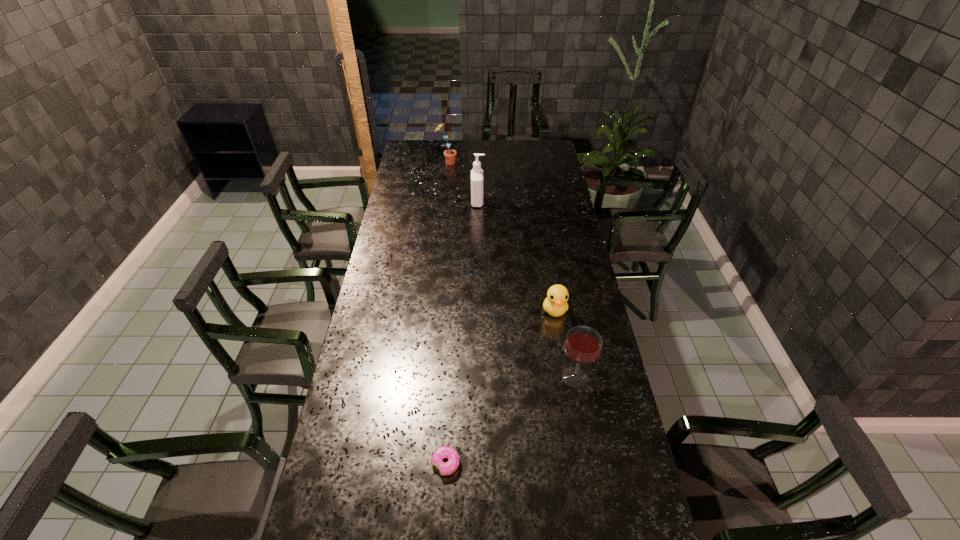
Where is `cleansing agent`? This screenshot has width=960, height=540. cleansing agent is located at coordinates (476, 173).

What are the coordinates of `the third object from left to right` in the screenshot? It's located at pyautogui.click(x=476, y=173).

You are a GUI agent. You are given a task and a screenshot of the screen. Output one action in this format:
    pyautogui.click(x=<x>, y=<y>)
    Task: Click on the farthest object
    This screenshot has width=960, height=540.
    Given the screenshot: What is the action you would take?
    pyautogui.click(x=450, y=155)

Identify the location of the fourth farthest object. Image resolution: width=960 pixels, height=540 pixels. (583, 344).

Locate an element on the screen. the second shortest object is located at coordinates (555, 304).

Locate an element on the screen. duck is located at coordinates (555, 304).

You are a GUI agent. You are given a task and a screenshot of the screen. Output one action in this format:
    pyautogui.click(x=<x>, y=<y>)
    Task: Click on the shortest object
    
    Given the screenshot: What is the action you would take?
    (446, 468)

Find the location of a particular element. This screenshot has width=960, height=540. the nearest object is located at coordinates (446, 468).

You are a GUI agent. You are given a task and a screenshot of the screen. Output one action in this format:
    pyautogui.click(x=<x>, y=<y>)
    Task: Click on the vacant region located 0.190m on the front label of the cleansing agent
    The height and width of the screenshot is (540, 960).
    Given the screenshot: What is the action you would take?
    click(524, 202)

The width and height of the screenshot is (960, 540). Find the location of `vacant space positioned 0.340m on the flower of the sunflower`. vacant space positioned 0.340m on the flower of the sunflower is located at coordinates (519, 163).